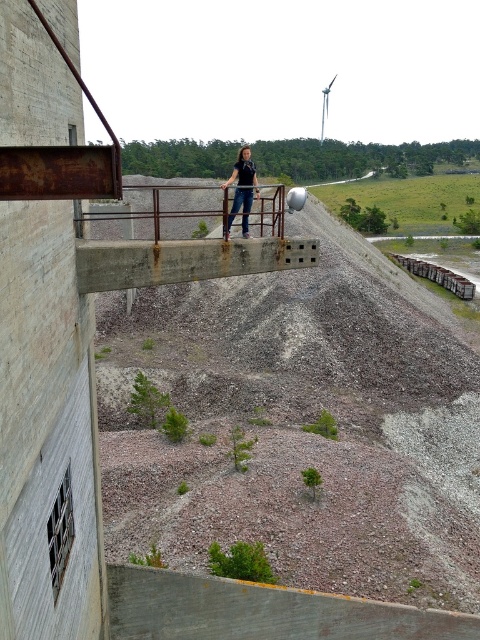
Question: Does gray gravel at center lie behind white plastic wind turbine at upper center?

Choices:
 (A) no
 (B) yes

Answer: (A)

Question: Estimate the real-world distances between objects in this image. Which object is closer to the rusty metal rail at center?

Choices:
 (A) gray gravel at center
 (B) denim jeans at center

Answer: (A)

Question: Can you confirm if gray gravel at center is positioned below white plastic wind turbine at upper center?

Choices:
 (A) yes
 (B) no

Answer: (A)

Question: Which point is closer to the camera?

Choices:
 (A) (408, 257)
 (B) (342, 508)
 (C) (244, 157)
 (D) (156, 273)

Answer: (D)

Question: Which of the following is the farthest from the observer?

Choices:
 (A) (127, 266)
 (B) (277, 497)
 (C) (465, 284)

Answer: (C)

Question: Does gray gravel at center appear on the left side of white plastic wind turbine at upper center?

Choices:
 (A) yes
 (B) no

Answer: (A)